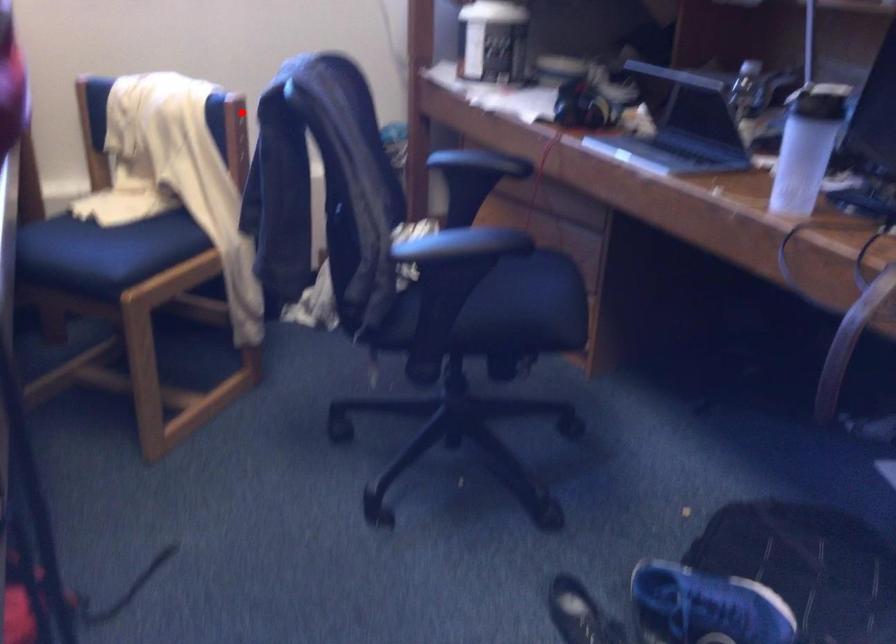
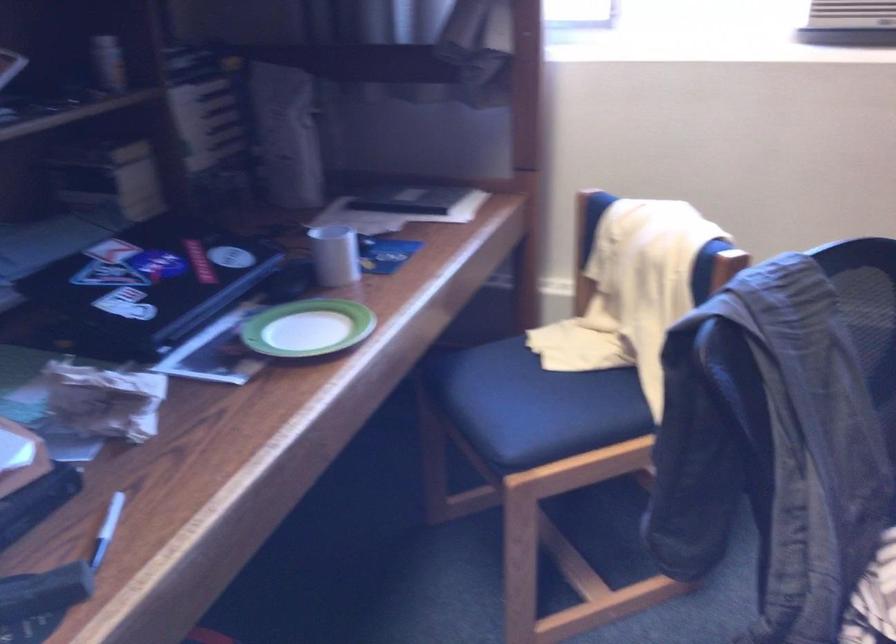
Locate, in the second image, the point that corresponds to the highlighted location in the first image.

(728, 263)